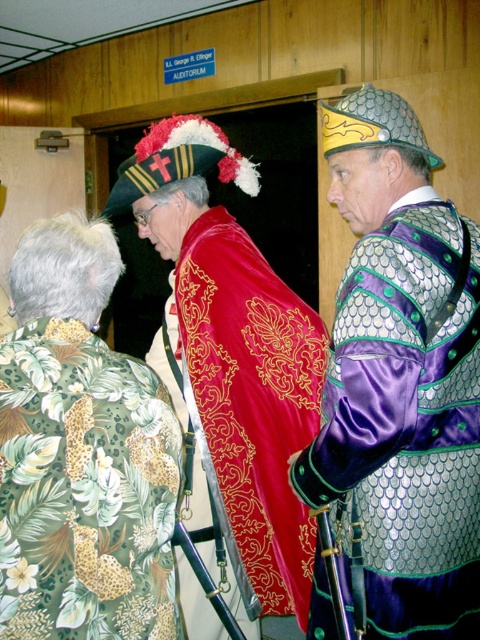
Looking at this image, which of these two, velvet gold embroidered robe at center or red satin robe at center, stands shorter?

red satin robe at center

Can you confirm if velvet gold embroidered robe at center is wider than red satin robe at center?

Yes, velvet gold embroidered robe at center is wider than red satin robe at center.

Which is behind, point (250, 586) or point (242, 620)?

Positioned behind is point (242, 620).

Locate an element on the screen. velvet gold embroidered robe at center is located at coordinates (233, 355).

Does metallic chainmail armor at right appear under green floral shirt at lower left?

Actually, metallic chainmail armor at right is above green floral shirt at lower left.

Can you confirm if metallic chainmail armor at right is shorter than green floral shirt at lower left?

No.

The image size is (480, 640). I want to click on metallic chainmail armor at right, so 400,380.

Is green floral shirt at lower left closer to the viewer compared to red satin robe at center?

That is True.

Which is above, green floral shirt at lower left or red satin robe at center?

Positioned higher is green floral shirt at lower left.

Describe the element at coordinates (82, 452) in the screenshot. I see `green floral shirt at lower left` at that location.

Where is `green floral shirt at lower left`? green floral shirt at lower left is located at coordinates (82, 452).